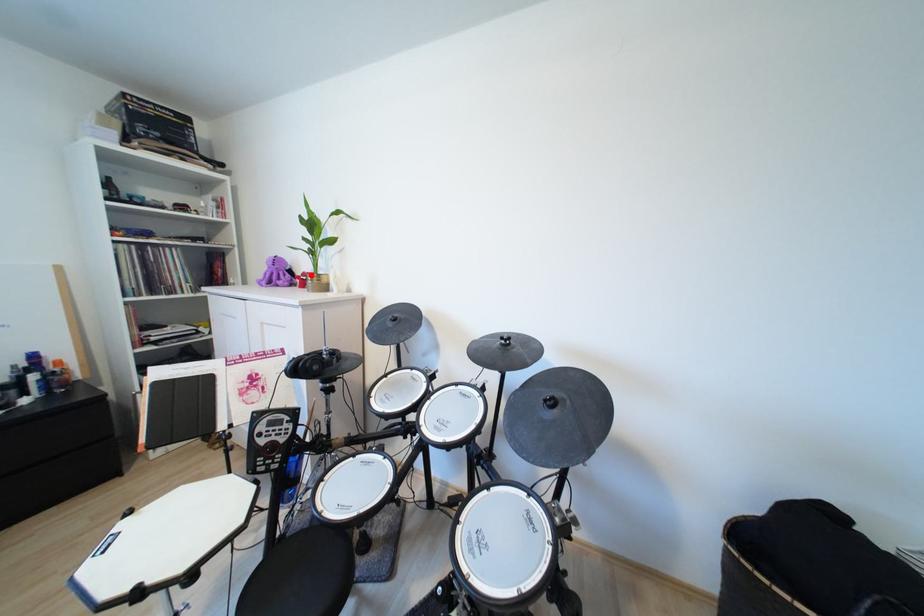
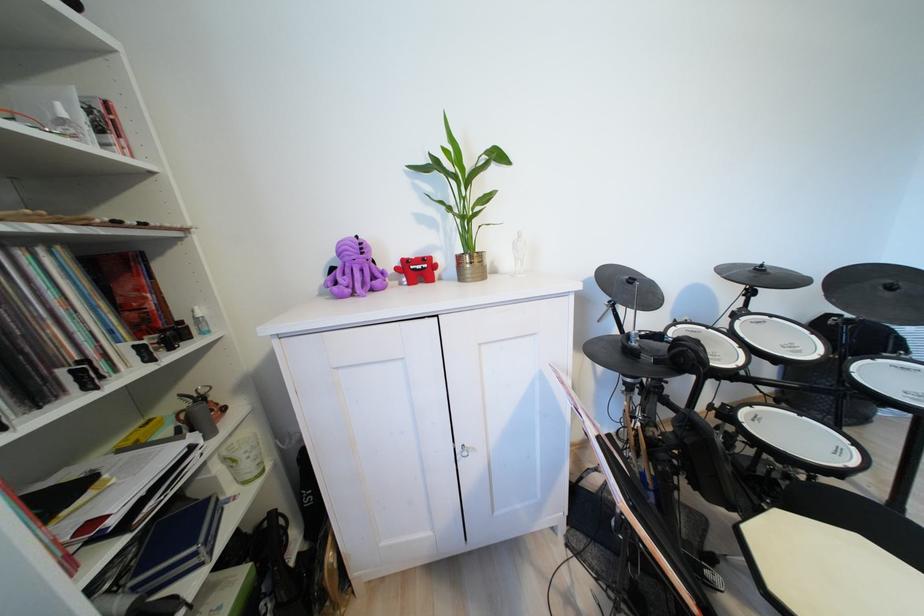
Where in the second image is the point corresponding to the highlighted location from the first image?

(411, 262)